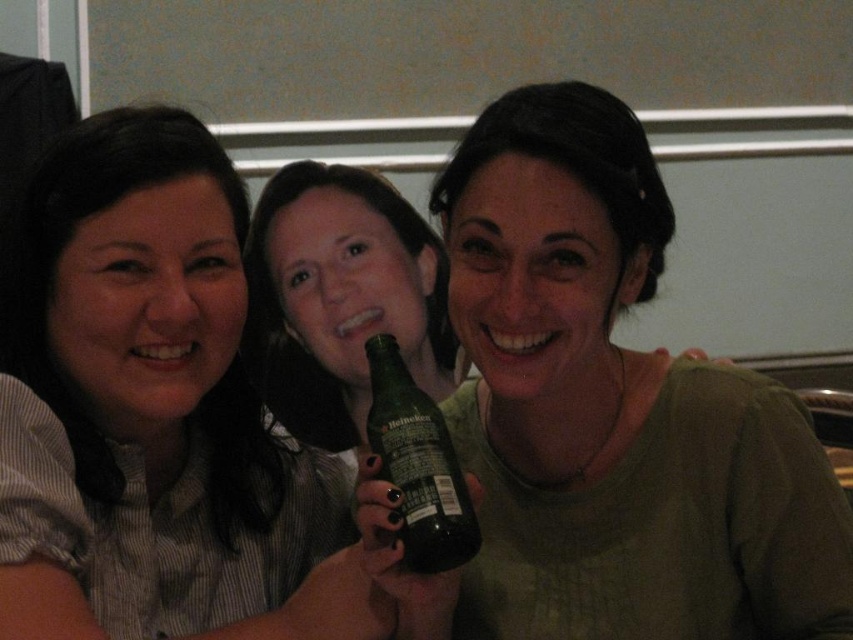
In the scene shown: Does green matte bottle at center have a greater height compared to green glass bottle at center?

Yes.

Between point (747, 570) and point (369, 353), which one is positioned behind?

The point (369, 353) is behind.

Does point (564, 278) come closer to viewer compared to point (372, 408)?

Yes, it is in front of point (372, 408).

You are a GUI agent. You are given a task and a screenshot of the screen. Output one action in this format:
    pyautogui.click(x=<x>, y=<y>)
    Task: Click on the green matte bottle at center
    
    Given the screenshot: What is the action you would take?
    pyautogui.click(x=614, y=410)

Between matte black shirt at left and green glass bottle at center, which one appears on the left side from the viewer's perspective?

matte black shirt at left

The width and height of the screenshot is (853, 640). What do you see at coordinates (154, 412) in the screenshot?
I see `matte black shirt at left` at bounding box center [154, 412].

Is point (244, 285) less distant than point (451, 518)?

No, (244, 285) is behind (451, 518).

Identify the location of matte black shirt at left. (154, 412).

Who is more distant from viewer, (567, 595) or (131, 115)?

Point (567, 595)

Is green matte bottle at center bigger than matte black shirt at left?

Yes, green matte bottle at center is bigger than matte black shirt at left.

The height and width of the screenshot is (640, 853). What are the coordinates of `green matte bottle at center` in the screenshot? It's located at (614, 410).

This screenshot has height=640, width=853. Find the location of `green matte bottle at center`. green matte bottle at center is located at coordinates (614, 410).